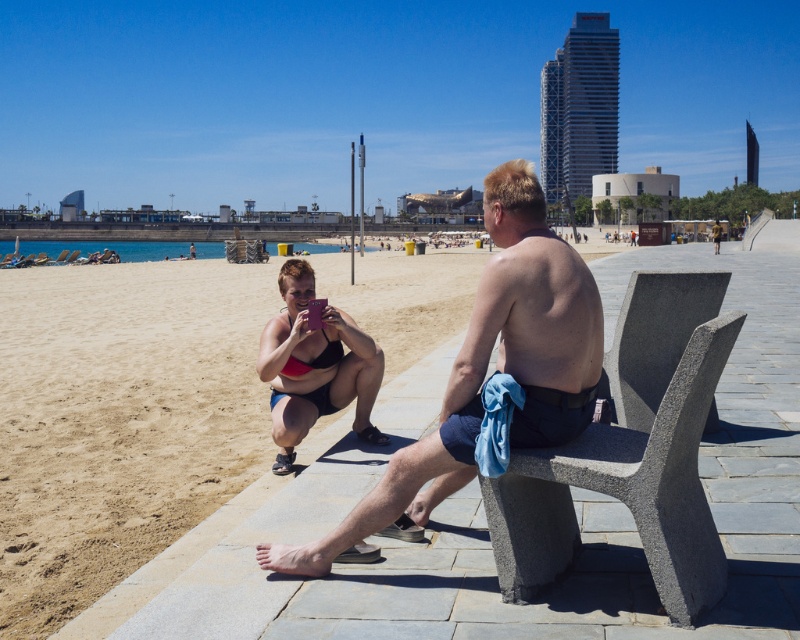
You are a photographer standing at the beachside promenade. You see the gray concrete bench at right and the matte pink bikini at center. Which object is closer to you?

The gray concrete bench at right is closer to you because it is in front of the matte pink bikini at center.

You are a photographer standing on the gray concrete bench at right. You want to capture a wide shot of the sandy beach at lower left. Which direction should you face to include both the bench and the beach in the frame?

You should face to the left because the sandy beach at lower left is positioned to the left of the gray concrete bench at right, so facing that direction will include both areas in the frame.

You are standing on the sandy beach at lower left and want to walk towards the smooth skin man at center. Which direction should you move to reach him?

To reach the smooth skin man at center from the sandy beach at lower left, you should move towards the center of the image since the sandy beach at lower left is further away from you than the smooth skin man at center.